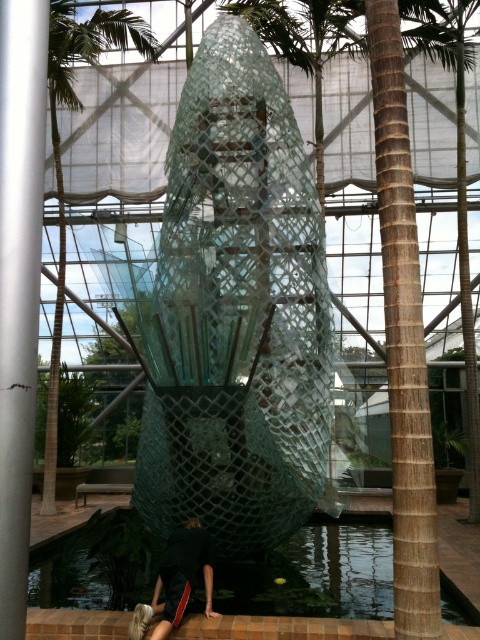
Question: Does green leafy palm tree at left have a larger size compared to brown textured palm tree at right?

Choices:
 (A) no
 (B) yes

Answer: (B)

Question: Which point appears farthest from the camera in this image?

Choices:
 (A) (63, 273)
 (B) (3, 220)
 (C) (467, 44)
 (D) (169, 580)

Answer: (A)

Question: Among these points, which one is nearest to the camera?

Choices:
 (A) [x=58, y=20]
 (B) [x=156, y=600]
 (C) [x=182, y=285]

Answer: (B)

Question: Among these points, which one is nearest to the camera?

Choices:
 (A) (3, 547)
 (B) (177, 440)

Answer: (A)

Question: Does green leafy palm tree at left appear over black fabric at lower center?

Choices:
 (A) yes
 (B) no

Answer: (A)

Question: Does silver metallic pole at left have a larger size compared to green leafy palm tree at left?

Choices:
 (A) yes
 (B) no

Answer: (B)